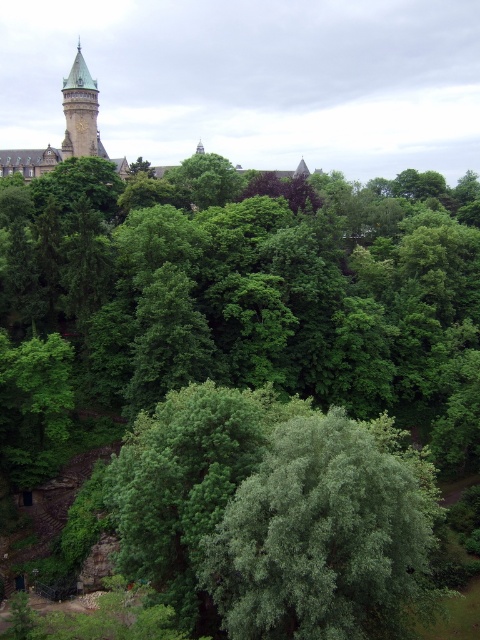
You are an architect designing a new pathway through the forest. You need to ensure that the pathway is wide enough to accommodate large machinery. The machinery requires a minimum width of 10 meters. Given the green leafy tree at center and the green stone tower at upper left, which object has a greater width, and will the pathway between them be sufficient for the machinery?

The green leafy tree at center has a greater width than the green stone tower at upper left. Since the pathway between them must be at least 10 meters wide, and the tree is wider than the tower, but the exact width of the pathway isn not provided. However, based on the information that the tree is wider than the tower, it suggests the pathway might be wider than the tower but we cannot confirm if it meets the 10 meter requirement without specific measurements.